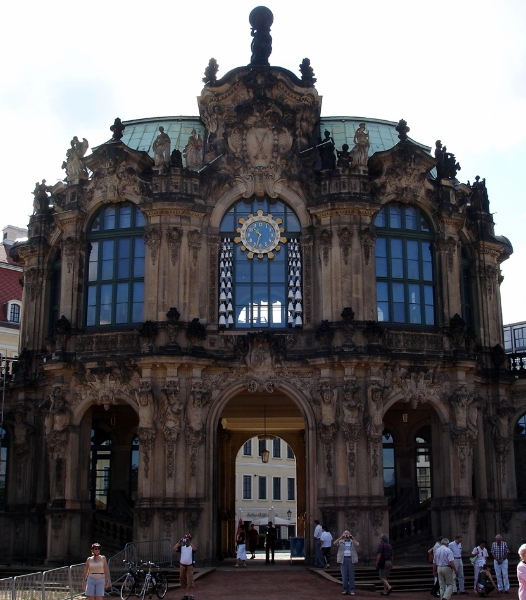
Where is `clock`? The width and height of the screenshot is (526, 600). clock is located at coordinates (259, 244).